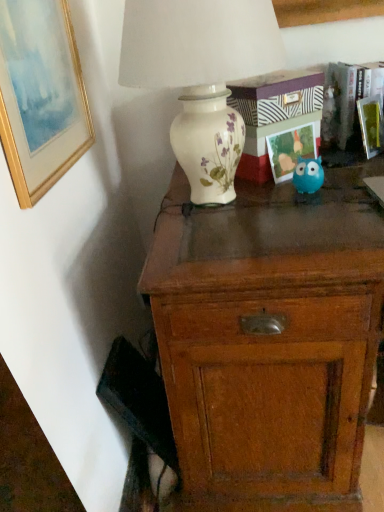
Find the location of `green matte picture frame at upper right, the 1th picture frame viewed from the right`. green matte picture frame at upper right, the 1th picture frame viewed from the right is located at coordinates (370, 125).

Identify the location of blue rubber toy at center. This screenshot has width=384, height=512. (308, 175).

What do you see at coordinates (199, 71) in the screenshot?
I see `white ceramic vase at upper center` at bounding box center [199, 71].

Identify the location of white ceramic vase at upper center. (199, 71).

What do you see at coordinates (290, 150) in the screenshot? The height and width of the screenshot is (512, 384). I see `matte plastic picture frame at upper right, marked as the 2th picture frame in a right-to-left arrangement` at bounding box center [290, 150].

Where is `green matte picture frame at upper right, the third picture frame when ordered from left to right`? The image size is (384, 512). green matte picture frame at upper right, the third picture frame when ordered from left to right is located at coordinates (370, 125).

Between point (361, 125) and point (294, 148), which one is positioned behind?

Positioned behind is point (361, 125).

Which object is positioned more to the right, green matte picture frame at upper right, the third picture frame when ordered from left to right, or matte plastic picture frame at upper right, marked as the 2th picture frame in a right-to-left arrangement?

Positioned to the right is green matte picture frame at upper right, the third picture frame when ordered from left to right.

From a real-world perspective, starting from the matte plastic picture frame at upper right, marked as the 2th picture frame in a right-to-left arrangement, which picture frame is the 1st one vertically above it? Please provide its 2D coordinates.

[(370, 125)]

Is matte plastic picture frame at upper right, marked as the 2th picture frame in a right-to-left arrangement, inside the boundaries of gold-framed painting at upper left, marked as the third picture frame in a right-to-left arrangement, or outside?

matte plastic picture frame at upper right, marked as the 2th picture frame in a right-to-left arrangement, is located beyond the bounds of gold-framed painting at upper left, marked as the third picture frame in a right-to-left arrangement.

Is matte plastic picture frame at upper right, marked as the 2th picture frame in a right-to-left arrangement, smaller than gold-framed painting at upper left, which is counted as the 1th picture frame, starting from the left?

Yes.

Based on the photo, is matte plastic picture frame at upper right, acting as the second picture frame starting from the left, closer to camera compared to gold-framed painting at upper left, which is counted as the 1th picture frame, starting from the left?

That is False.

From a real-world perspective, which is physically below, matte plastic picture frame at upper right, marked as the 2th picture frame in a right-to-left arrangement, or gold-framed painting at upper left, marked as the third picture frame in a right-to-left arrangement?

matte plastic picture frame at upper right, marked as the 2th picture frame in a right-to-left arrangement.

Considering the sizes of wooden chest of drawers at center and white ceramic vase at upper center in the image, is wooden chest of drawers at center wider or thinner than white ceramic vase at upper center?

Clearly, wooden chest of drawers at center has more width compared to white ceramic vase at upper center.

Consider the image. How many degrees apart are the facing directions of wooden chest of drawers at center and white ceramic vase at upper center?

The angle between the facing direction of wooden chest of drawers at center and the facing direction of white ceramic vase at upper center is 4.02 degrees.

Based on the photo, from the image's perspective, is wooden chest of drawers at center under white ceramic vase at upper center?

Correct, wooden chest of drawers at center appears lower than white ceramic vase at upper center in the image.

How much distance is there between wooden chest of drawers at center and white ceramic vase at upper center?

wooden chest of drawers at center and white ceramic vase at upper center are 14.32 inches apart from each other.

Is point (23, 78) closer to viewer compared to point (313, 184)?

Yes, it is.

Considering the relative positions of gold-framed painting at upper left, marked as the third picture frame in a right-to-left arrangement, and blue rubber toy at center in the image provided, is gold-framed painting at upper left, marked as the third picture frame in a right-to-left arrangement, to the left or to the right of blue rubber toy at center?

gold-framed painting at upper left, marked as the third picture frame in a right-to-left arrangement, is to the left of blue rubber toy at center.

Who is taller, gold-framed painting at upper left, marked as the third picture frame in a right-to-left arrangement, or blue rubber toy at center?

With more height is gold-framed painting at upper left, marked as the third picture frame in a right-to-left arrangement.

Is white ceramic vase at upper center far away from wooden chest of drawers at center?

No, white ceramic vase at upper center is in close proximity to wooden chest of drawers at center.

From a real-world perspective, is white ceramic vase at upper center positioned above or below wooden chest of drawers at center?

In terms of real-world spatial position, white ceramic vase at upper center is above wooden chest of drawers at center.

Does white ceramic vase at upper center have a greater width compared to wooden chest of drawers at center?

Incorrect, the width of white ceramic vase at upper center does not surpass that of wooden chest of drawers at center.

Is the depth of white ceramic vase at upper center less than that of wooden chest of drawers at center?

That is False.

Can you tell me how much green matte picture frame at upper right, the 1th picture frame viewed from the right, and wooden chest of drawers at center differ in facing direction?

The angle between the facing direction of green matte picture frame at upper right, the 1th picture frame viewed from the right, and the facing direction of wooden chest of drawers at center is 44.8 degrees.

From the image's perspective, is green matte picture frame at upper right, the third picture frame when ordered from left to right, located above wooden chest of drawers at center?

Yes.

Is the depth of green matte picture frame at upper right, the 1th picture frame viewed from the right, less than that of wooden chest of drawers at center?

No, it is not.

Is green matte picture frame at upper right, the 1th picture frame viewed from the right, next to wooden chest of drawers at center?

No, green matte picture frame at upper right, the 1th picture frame viewed from the right, is not touching wooden chest of drawers at center.

Can you tell me how much green matte picture frame at upper right, the third picture frame when ordered from left to right, and gold-framed painting at upper left, marked as the third picture frame in a right-to-left arrangement, differ in facing direction?

48.5 degrees.

From a real-world perspective, is green matte picture frame at upper right, the 1th picture frame viewed from the right, physically below gold-framed painting at upper left, marked as the third picture frame in a right-to-left arrangement?

Yes.

Which object is wider, green matte picture frame at upper right, the third picture frame when ordered from left to right, or gold-framed painting at upper left, marked as the third picture frame in a right-to-left arrangement?

Wider between the two is green matte picture frame at upper right, the third picture frame when ordered from left to right.

From the image's perspective, which one is positioned lower, green matte picture frame at upper right, the third picture frame when ordered from left to right, or gold-framed painting at upper left, marked as the third picture frame in a right-to-left arrangement?

From the image's view, gold-framed painting at upper left, marked as the third picture frame in a right-to-left arrangement, is below.

This screenshot has width=384, height=512. Find the location of `picture frame behind the matte plastic picture frame at upper right, acting as the second picture frame starting from the left`. picture frame behind the matte plastic picture frame at upper right, acting as the second picture frame starting from the left is located at coordinates (370, 125).

You are a GUI agent. You are given a task and a screenshot of the screen. Output one action in this format:
    pyautogui.click(x=<x>, y=<y>)
    Task: Click on the 2nd picture frame above the matte plastic picture frame at upper right, marked as the 2th picture frame in a right-to-left arrangement (from a real-world perspective)
    
    Given the screenshot: What is the action you would take?
    pyautogui.click(x=40, y=96)

When comparing their distances from blue rubber toy at center, does green matte picture frame at upper right, the third picture frame when ordered from left to right, or white ceramic vase at upper center seem further?

white ceramic vase at upper center lies further to blue rubber toy at center than the other object.

Based on their spatial positions, is green matte picture frame at upper right, the third picture frame when ordered from left to right, or wooden chest of drawers at center further from gold-framed painting at upper left, which is counted as the 1th picture frame, starting from the left?

Based on the image, green matte picture frame at upper right, the third picture frame when ordered from left to right, appears to be further to gold-framed painting at upper left, which is counted as the 1th picture frame, starting from the left.

Estimate the real-world distances between objects in this image. Which object is further from gold-framed painting at upper left, marked as the third picture frame in a right-to-left arrangement, green matte picture frame at upper right, the third picture frame when ordered from left to right, or white ceramic vase at upper center?

Based on the image, green matte picture frame at upper right, the third picture frame when ordered from left to right, appears to be further to gold-framed painting at upper left, marked as the third picture frame in a right-to-left arrangement.

Considering their positions, is white ceramic vase at upper center positioned further to matte plastic picture frame at upper right, marked as the 2th picture frame in a right-to-left arrangement, than wooden chest of drawers at center?

Among the two, wooden chest of drawers at center is located further to matte plastic picture frame at upper right, marked as the 2th picture frame in a right-to-left arrangement.

Considering their positions, is green matte picture frame at upper right, the third picture frame when ordered from left to right, positioned closer to gold-framed painting at upper left, which is counted as the 1th picture frame, starting from the left, than blue rubber toy at center?

blue rubber toy at center is closer to gold-framed painting at upper left, which is counted as the 1th picture frame, starting from the left.

From the image, which object appears to be nearer to blue rubber toy at center, gold-framed painting at upper left, marked as the third picture frame in a right-to-left arrangement, or wooden chest of drawers at center?

wooden chest of drawers at center is positioned closer to the anchor blue rubber toy at center.

Looking at this image, estimate the real-world distances between objects in this image. Which object is further from wooden chest of drawers at center, gold-framed painting at upper left, which is counted as the 1th picture frame, starting from the left, or blue rubber toy at center?

Based on the image, gold-framed painting at upper left, which is counted as the 1th picture frame, starting from the left, appears to be further to wooden chest of drawers at center.

Estimate the real-world distances between objects in this image. Which object is closer to wooden chest of drawers at center, gold-framed painting at upper left, which is counted as the 1th picture frame, starting from the left, or green matte picture frame at upper right, the 1th picture frame viewed from the right?

gold-framed painting at upper left, which is counted as the 1th picture frame, starting from the left, is closer to wooden chest of drawers at center.

Identify the location of picture frame between gold-framed painting at upper left, marked as the third picture frame in a right-to-left arrangement, and green matte picture frame at upper right, the 1th picture frame viewed from the right, from left to right. The width and height of the screenshot is (384, 512). (290, 150).

This screenshot has height=512, width=384. Find the location of `toy between white ceramic vase at upper center and matte plastic picture frame at upper right, marked as the 2th picture frame in a right-to-left arrangement, in the front-back direction`. toy between white ceramic vase at upper center and matte plastic picture frame at upper right, marked as the 2th picture frame in a right-to-left arrangement, in the front-back direction is located at coordinates (308, 175).

The image size is (384, 512). Find the location of `toy located between white ceramic vase at upper center and green matte picture frame at upper right, the third picture frame when ordered from left to right, in the left-right direction`. toy located between white ceramic vase at upper center and green matte picture frame at upper right, the third picture frame when ordered from left to right, in the left-right direction is located at coordinates (308, 175).

Where is `toy situated between matte plastic picture frame at upper right, acting as the second picture frame starting from the left, and green matte picture frame at upper right, the third picture frame when ordered from left to right, from left to right`? toy situated between matte plastic picture frame at upper right, acting as the second picture frame starting from the left, and green matte picture frame at upper right, the third picture frame when ordered from left to right, from left to right is located at coordinates (308, 175).